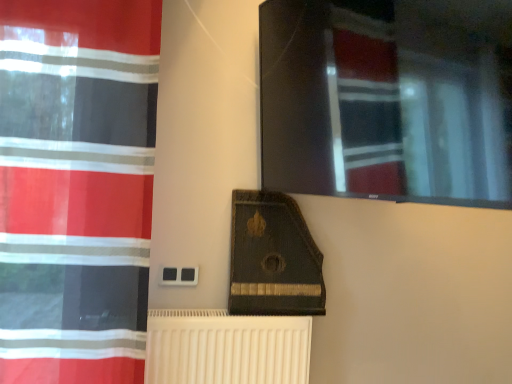
The image size is (512, 384). I want to click on vacant point above white ribbed radiator at lower center (from a real-world perspective), so click(x=241, y=313).